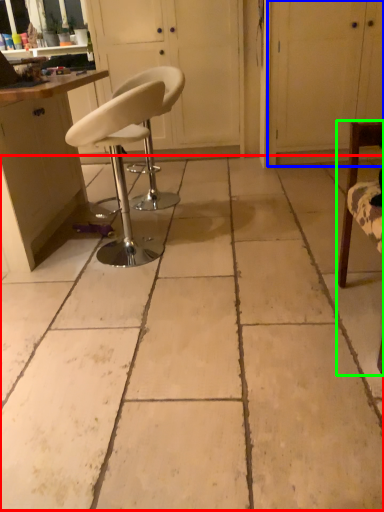
Question: Estimate the real-world distances between objects in this image. Which object is farther from concrete (highlighted by a red box), screen door (highlighted by a blue box) or chair (highlighted by a green box)?

Choices:
 (A) screen door
 (B) chair

Answer: (A)